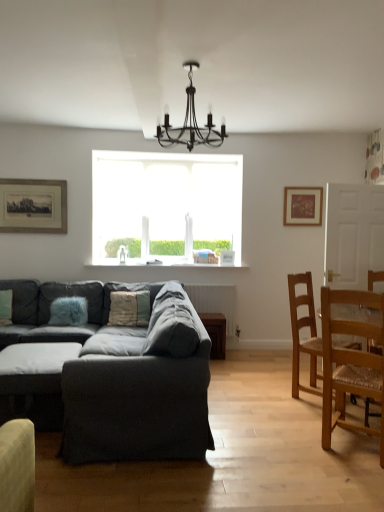
Find the location of a particular element. dark gray fabric ottoman at lower left is located at coordinates (34, 382).

Describe the element at coordinates (299, 336) in the screenshot. I see `wooden textured chair at right, which ranks as the first chair in back-to-front order` at that location.

What is the approximate height of white frosted glass window at center?

white frosted glass window at center is 4.14 feet tall.

Where is `textured gray couch at center`? This screenshot has width=384, height=512. textured gray couch at center is located at coordinates (104, 381).

What is the approximate height of textured gray couch at center?

It is 83.64 centimeters.

Measure the distance between point (x=357, y=381) and camera.

Point (x=357, y=381) and camera are 2.72 meters apart.

Locate an element on the screen. The height and width of the screenshot is (512, 384). black metal chandelier at upper center is located at coordinates (190, 122).

What do you see at coordinates (33, 206) in the screenshot? The image size is (384, 512). I see `wooden framed print at upper left, positioned as the second picture frame in right-to-left order` at bounding box center [33, 206].

At what (x,y) coordinates should I click in order to perform the action: click on wooden picture frame at upper right, which appears as the 1th picture frame when viewed from the right. Please return your answer as a coordinate pair (x, y). Looking at the image, I should click on (303, 206).

From the picture: From the image's perspective, who appears lower, wooden framed print at upper left, the 2th picture frame viewed from the back, or white frosted glass window at center?

wooden framed print at upper left, the 2th picture frame viewed from the back, is shown below in the image.

Is wooden framed print at upper left, positioned as the second picture frame in right-to-left order, turned away from white frosted glass window at center?

No, white frosted glass window at center is not at the back of wooden framed print at upper left, positioned as the second picture frame in right-to-left order.

Which is more to the right, wooden framed print at upper left, which is counted as the 1th picture frame, starting from the front, or white frosted glass window at center?

white frosted glass window at center is more to the right.

From a real-world perspective, is wooden framed print at upper left, positioned as the second picture frame in right-to-left order, physically above white frosted glass window at center?

No.

Find the location of a particular element. The width and height of the screenshot is (384, 512). studio couch in front of the dark gray fabric ottoman at lower left is located at coordinates (104, 381).

From a real-world perspective, is dark gray fabric ottoman at lower left positioned under textured gray couch at center based on gravity?

Yes, from a real-world perspective, dark gray fabric ottoman at lower left is below textured gray couch at center.

In the scene shown: Considering the sizes of dark gray fabric ottoman at lower left and textured gray couch at center in the image, is dark gray fabric ottoman at lower left taller or shorter than textured gray couch at center?

Considering their sizes, dark gray fabric ottoman at lower left has less height than textured gray couch at center.

Is dark gray fabric ottoman at lower left at the left side of textured gray couch at center?

Yes, dark gray fabric ottoman at lower left is to the left of textured gray couch at center.

Can you confirm if white frosted glass window at center is positioned to the right of wooden picture frame at upper right, arranged as the second picture frame when viewed from the front?

No.

From the image's perspective, which one is positioned lower, white frosted glass window at center or wooden picture frame at upper right, arranged as the second picture frame when viewed from the front?

white frosted glass window at center.

How much distance is there between white frosted glass window at center and wooden picture frame at upper right, which ranks as the 1th picture frame in back-to-front order?

white frosted glass window at center and wooden picture frame at upper right, which ranks as the 1th picture frame in back-to-front order, are 1.61 meters apart from each other.

You are a GUI agent. You are given a task and a screenshot of the screen. Output one action in this format:
    pyautogui.click(x=<x>, y=<y>)
    Task: Click on the window lying on the left of wooden picture frame at upper right, arranged as the second picture frame when viewed from the front
    Image resolution: width=384 pixels, height=512 pixels.
    Given the screenshot: What is the action you would take?
    pyautogui.click(x=165, y=205)

Measure the distance between white frosted glass window at center and wooden framed print at upper left, which is the 1th picture frame in left-to-right order.

The distance of white frosted glass window at center from wooden framed print at upper left, which is the 1th picture frame in left-to-right order, is 3.45 feet.

From a real-world perspective, is white frosted glass window at center located beneath wooden framed print at upper left, the 2th picture frame viewed from the back?

No, from a real-world perspective, white frosted glass window at center is not below wooden framed print at upper left, the 2th picture frame viewed from the back.

Would you say white frosted glass window at center is outside wooden framed print at upper left, which is counted as the 1th picture frame, starting from the front?

white frosted glass window at center is positioned outside wooden framed print at upper left, which is counted as the 1th picture frame, starting from the front.

Which object is wider, white frosted glass window at center or wooden framed print at upper left, which is counted as the 1th picture frame, starting from the front?

With larger width is white frosted glass window at center.

How different are the orientations of wooden framed print at upper left, the 2th picture frame viewed from the back, and wooden textured chair at right, which ranks as the first chair in back-to-front order, in degrees?

They differ by 46.5 degrees in their facing directions.

Based on the photo, is wooden textured chair at right, which ranks as the first chair in back-to-front order, inside wooden framed print at upper left, which is counted as the 1th picture frame, starting from the front?

No, wooden textured chair at right, which ranks as the first chair in back-to-front order, is not a part of wooden framed print at upper left, which is counted as the 1th picture frame, starting from the front.

Could you tell me if wooden framed print at upper left, the 2th picture frame viewed from the back, is facing wooden textured chair at right, which ranks as the first chair in back-to-front order?

No, wooden framed print at upper left, the 2th picture frame viewed from the back, is not turned towards wooden textured chair at right, which ranks as the first chair in back-to-front order.

Considering the relative sizes of wooden framed print at upper left, positioned as the second picture frame in right-to-left order, and wooden textured chair at right, which ranks as the first chair in back-to-front order, in the image provided, is wooden framed print at upper left, positioned as the second picture frame in right-to-left order, smaller than wooden textured chair at right, which ranks as the first chair in back-to-front order,?

Yes, wooden framed print at upper left, positioned as the second picture frame in right-to-left order, is smaller than wooden textured chair at right, which ranks as the first chair in back-to-front order.

Which is less distant, (77,302) or (27,392)?

Point (77,302).

Is fuzzy blue pillow at left, which is counted as the 1th pillow, starting from the left, looking in the opposite direction of textured gray couch at center?

No, fuzzy blue pillow at left, which is counted as the 1th pillow, starting from the left, is not facing the opposite direction of textured gray couch at center.

From a real-world perspective, is fuzzy blue pillow at left, which is counted as the 1th pillow, starting from the left, positioned above or below textured gray couch at center?

From a real-world perspective, fuzzy blue pillow at left, which is counted as the 1th pillow, starting from the left, is physically above textured gray couch at center.

Is fuzzy blue pillow at left, which is counted as the 1th pillow, starting from the left, beside textured gray couch at center?

They are not placed beside each other.

Considering the sizes of objects textured beige pillow at center, the 2th pillow positioned from the left, and wooden textured chair at right, which ranks as the second chair in front-to-back order, in the image provided, who is smaller, textured beige pillow at center, the 2th pillow positioned from the left, or wooden textured chair at right, which ranks as the second chair in front-to-back order,?

Smaller between the two is textured beige pillow at center, the 2th pillow positioned from the left.

Based on the photo, is textured beige pillow at center, the 2th pillow positioned from the left, further to camera compared to wooden textured chair at right, which ranks as the first chair in back-to-front order?

That is True.

From a real-world perspective, who is located lower, textured beige pillow at center, the 2th pillow positioned from the left, or wooden textured chair at right, which ranks as the first chair in back-to-front order?

wooden textured chair at right, which ranks as the first chair in back-to-front order, is physically lower.

Locate an element on the screen. This screenshot has height=512, width=384. window above the wooden framed print at upper left, positioned as the second picture frame in right-to-left order (from a real-world perspective) is located at coordinates (165, 205).

What are the coordinates of `table behind the textured gray couch at center` in the screenshot? It's located at (34, 382).

Based on their spatial positions, is wooden framed print at upper left, which is counted as the 1th picture frame, starting from the front, or textured beige pillow at center, the 2th pillow positioned from the left, closer to black metal chandelier at upper center?

textured beige pillow at center, the 2th pillow positioned from the left, lies closer to black metal chandelier at upper center than the other object.

Based on their spatial positions, is dark gray fabric ottoman at lower left or black metal chandelier at upper center further from wooden textured chair at right, which ranks as the second chair in front-to-back order?

The object further to wooden textured chair at right, which ranks as the second chair in front-to-back order, is dark gray fabric ottoman at lower left.

From the image, which object appears to be nearer to textured beige pillow at center, arranged as the 1th pillow when viewed from the right, dark gray fabric ottoman at lower left or textured gray couch at center?

textured gray couch at center lies closer to textured beige pillow at center, arranged as the 1th pillow when viewed from the right, than the other object.

Estimate the real-world distances between objects in this image. Which object is further from dark gray fabric ottoman at lower left, textured gray couch at center or textured beige pillow at center, the 2th pillow positioned from the left?

The object further to dark gray fabric ottoman at lower left is textured beige pillow at center, the 2th pillow positioned from the left.

Consider the image. Which object lies further to the anchor point wooden textured chair at right, which ranks as the first chair in back-to-front order, fuzzy blue pillow at left, the second pillow from the right, or black metal chandelier at upper center?

fuzzy blue pillow at left, the second pillow from the right, is positioned further to the anchor wooden textured chair at right, which ranks as the first chair in back-to-front order.

Estimate the real-world distances between objects in this image. Which object is closer to wooden picture frame at upper right, which appears as the 1th picture frame when viewed from the right, white frosted glass window at center or light brown wooden chair at right, which appears as the second chair when viewed from the back?

white frosted glass window at center is closer to wooden picture frame at upper right, which appears as the 1th picture frame when viewed from the right.

Which object lies further to the anchor point white frosted glass window at center, light brown wooden chair at right, which appears as the second chair when viewed from the back, or wooden framed print at upper left, the 2th picture frame viewed from the back?

Among the two, light brown wooden chair at right, which appears as the second chair when viewed from the back, is located further to white frosted glass window at center.

Considering their positions, is light brown wooden chair at right, the 1th chair viewed from the front, positioned closer to textured beige pillow at center, arranged as the 1th pillow when viewed from the right, than fuzzy blue pillow at left, the second pillow from the right?

fuzzy blue pillow at left, the second pillow from the right, lies closer to textured beige pillow at center, arranged as the 1th pillow when viewed from the right, than the other object.

The width and height of the screenshot is (384, 512). Identify the location of chair located between textured beige pillow at center, the 2th pillow positioned from the left, and wooden textured chair at right, which ranks as the first chair in back-to-front order, in the left-right direction. (351, 358).

This screenshot has width=384, height=512. Find the location of `light fixture located between wooden framed print at upper left, which is counted as the 1th picture frame, starting from the front, and light brown wooden chair at right, which appears as the second chair when viewed from the back, in the left-right direction`. light fixture located between wooden framed print at upper left, which is counted as the 1th picture frame, starting from the front, and light brown wooden chair at right, which appears as the second chair when viewed from the back, in the left-right direction is located at coordinates (190, 122).

You are a GUI agent. You are given a task and a screenshot of the screen. Output one action in this format:
    pyautogui.click(x=<x>, y=<y>)
    Task: Click on the light fixture between dark gray fabric ottoman at lower left and light brown wooden chair at right, the 1th chair viewed from the front, in the horizontal direction
    Image resolution: width=384 pixels, height=512 pixels.
    Given the screenshot: What is the action you would take?
    pyautogui.click(x=190, y=122)

Where is `chair positioned between black metal chandelier at upper center and wooden picture frame at upper right, arranged as the second picture frame when viewed from the front, from near to far`? chair positioned between black metal chandelier at upper center and wooden picture frame at upper right, arranged as the second picture frame when viewed from the front, from near to far is located at coordinates (299, 336).